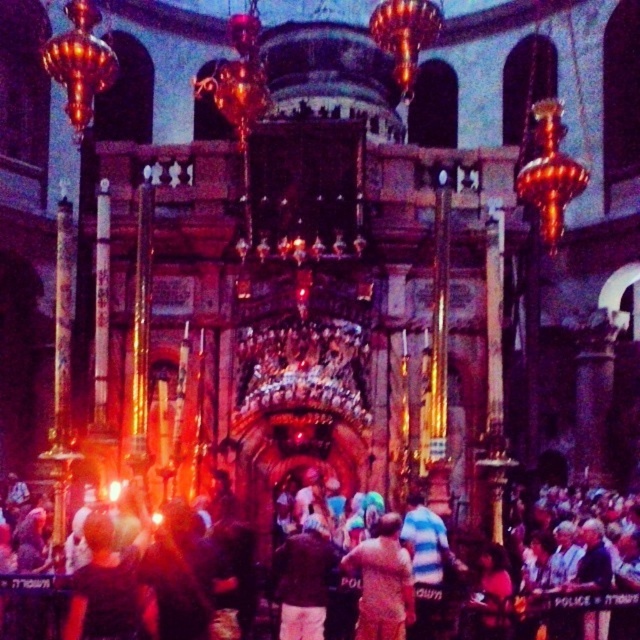
Is brown fabric shirt at center taller than light brown leather jacket at center?

Indeed, brown fabric shirt at center has a greater height compared to light brown leather jacket at center.

Consider the image. Between brown fabric shirt at center and light brown leather jacket at center, which one is positioned lower?

light brown leather jacket at center is lower down.

Describe the element at coordinates (381, 582) in the screenshot. I see `brown fabric shirt at center` at that location.

Identify the location of brown fabric shirt at center. The height and width of the screenshot is (640, 640). tap(381, 582).